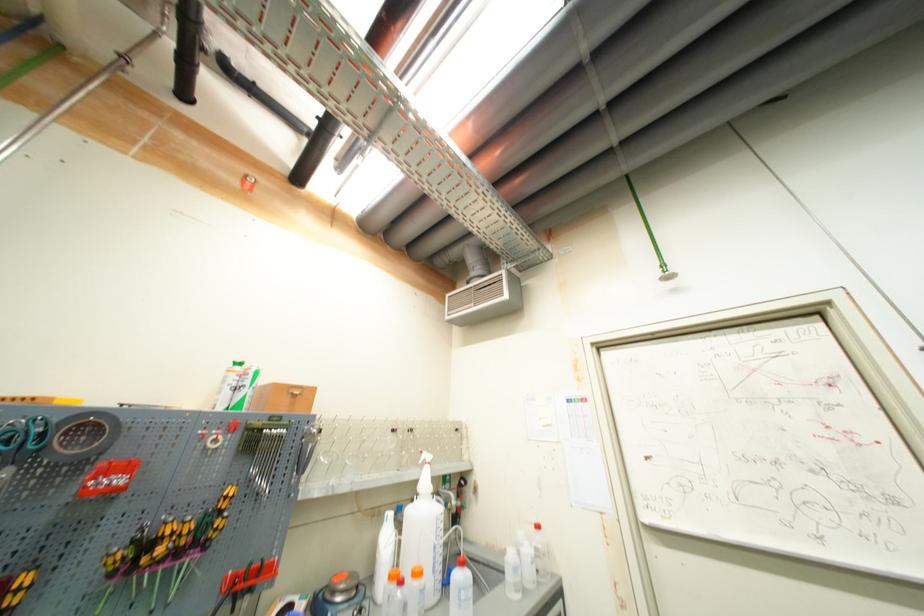
This screenshot has height=616, width=924. What do you see at coordinates (248, 182) in the screenshot?
I see `the red bottle cap` at bounding box center [248, 182].